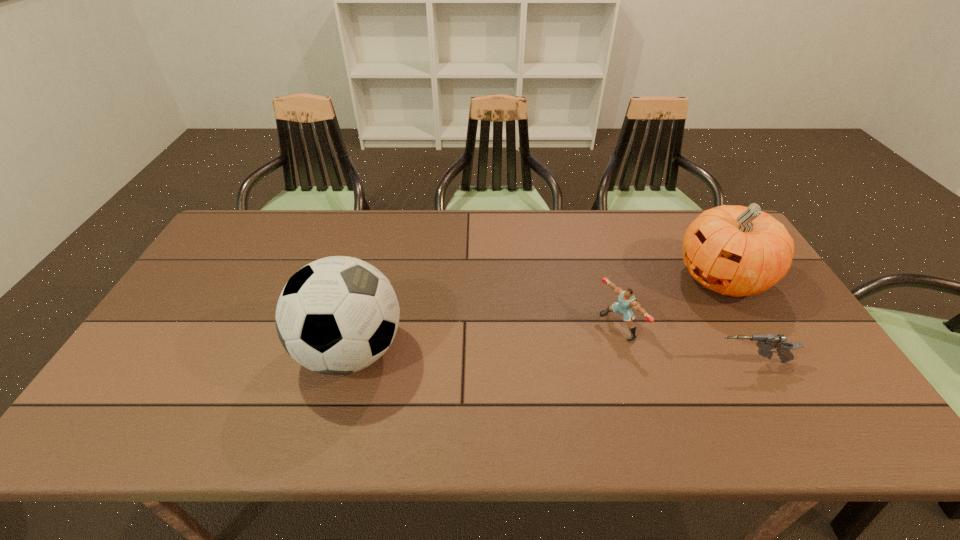
Locate an element on the screen. This screenshot has height=540, width=960. empty space between the leftmost object and the shortest object is located at coordinates (551, 356).

Where is `vacant area that lies between the shortest object and the third object from right to left`? The width and height of the screenshot is (960, 540). vacant area that lies between the shortest object and the third object from right to left is located at coordinates (684, 344).

Find the location of a particular element. free point between the shortest object and the pumpkin is located at coordinates (736, 320).

Locate an element on the screen. free space between the soccer ball and the third tallest object is located at coordinates (485, 339).

Locate an element on the screen. This screenshot has width=960, height=540. empty space that is in between the leftmost object and the third tallest object is located at coordinates (485, 339).

The width and height of the screenshot is (960, 540). Find the location of `free space between the leftmost object and the puncher`. free space between the leftmost object and the puncher is located at coordinates (485, 339).

Find the location of a particular element. vacant space that's between the third tallest object and the leftmost object is located at coordinates (485, 339).

Locate an element on the screen. The height and width of the screenshot is (540, 960). the closest object to the third tallest object is located at coordinates (767, 342).

Select which object appears as the second closest to the pumpkin. Please provide its 2D coordinates. Your answer should be formatted as a tuple, i.e. [(x, y)], where the tuple contains the x and y coordinates of a point satisfying the conditions above.

[(626, 300)]

Where is `vacant position in the image that satisfies the following two spatial constraints: 1. on the front side of the gun; 2. at the barrel of the third object from right to left`? The width and height of the screenshot is (960, 540). vacant position in the image that satisfies the following two spatial constraints: 1. on the front side of the gun; 2. at the barrel of the third object from right to left is located at coordinates (629, 362).